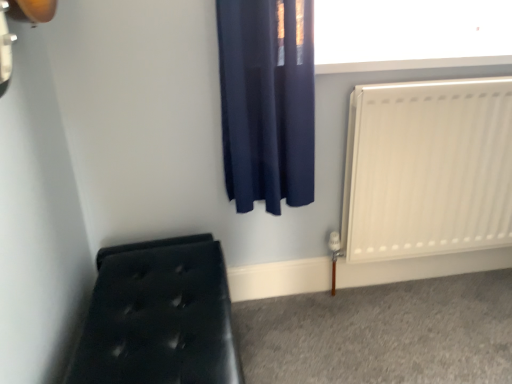
I want to click on free space below dark blue fabric curtain at upper center (from a real-world perspective), so click(x=287, y=306).